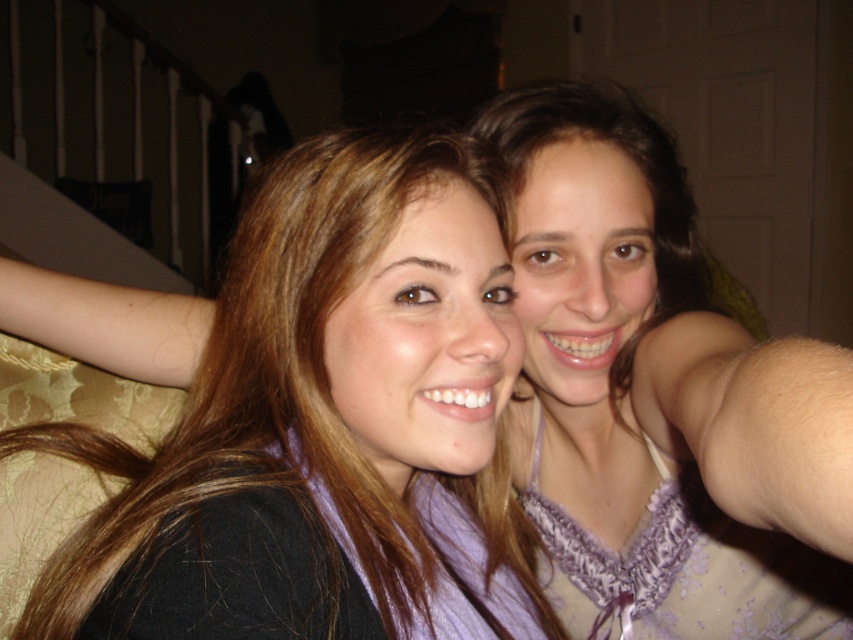
Question: Which point is farther to the camera?

Choices:
 (A) purple lace dress at upper right
 (B) matte purple scarf at center

Answer: (B)

Question: Which object appears farthest from the camera in this image?

Choices:
 (A) matte purple scarf at center
 (B) purple lace dress at upper right

Answer: (A)

Question: Which of the following is the closest to the observer?

Choices:
 (A) (97, 296)
 (B) (761, 465)

Answer: (B)

Question: Can you confirm if matte purple scarf at center is wider than purple lace dress at upper right?

Choices:
 (A) yes
 (B) no

Answer: (A)

Question: Is matte purple scarf at center positioned before purple lace dress at upper right?

Choices:
 (A) no
 (B) yes

Answer: (A)

Question: Considering the relative positions of matte purple scarf at center and purple lace dress at upper right in the image provided, where is matte purple scarf at center located with respect to purple lace dress at upper right?

Choices:
 (A) below
 (B) above

Answer: (B)